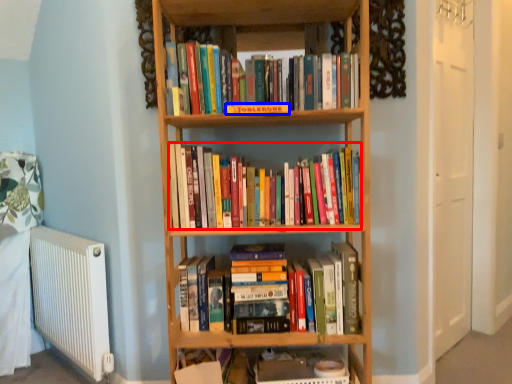
Question: Which object appears farthest to the camera in this image, book (highlighted by a red box) or paperback book (highlighted by a blue box)?

Choices:
 (A) book
 (B) paperback book

Answer: (A)